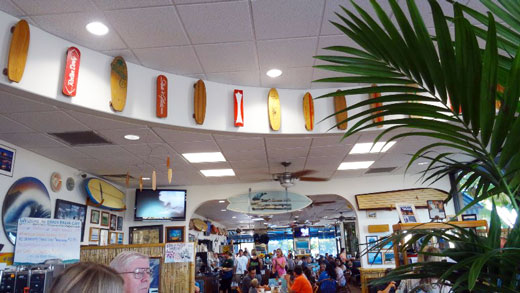
You are a GUI agent. You are given a task and a screenshot of the screen. Output one action in this format:
    pyautogui.click(x=<x>, y=<y>)
    Task: Click on the ceiling light
    
    Given the screenshot: What is the action you would take?
    pyautogui.click(x=129, y=136), pyautogui.click(x=92, y=30), pyautogui.click(x=272, y=68), pyautogui.click(x=198, y=160), pyautogui.click(x=217, y=172), pyautogui.click(x=375, y=146), pyautogui.click(x=364, y=166)